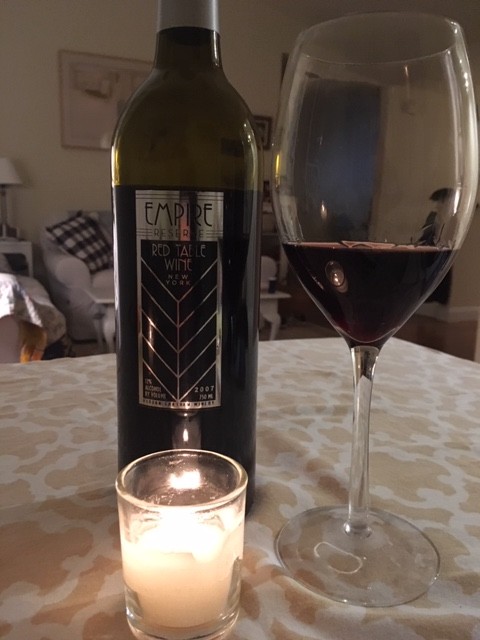
Find the location of `lamp`. lamp is located at coordinates (16, 170).